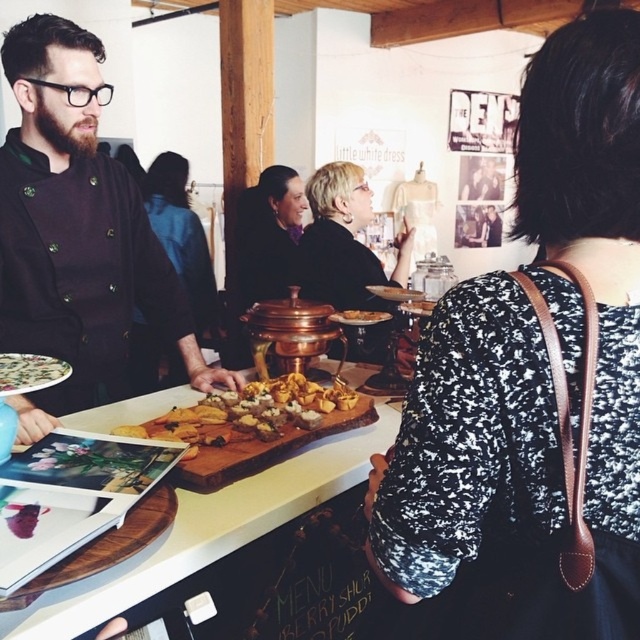
You are a guest at the event and want to place a golden brown cracker at center onto the wooden cutting board at center. Can you do this without moving any other items on the table?

The distance between the wooden cutting board at center and the golden brown cracker at center is 6.20 inches. Since you can easily reach across this distance, you can place the cracker onto the board without moving other items.

You are a guest at the event and want to move from the wooden cutting board at center to the black velvet dress at center. Is there enough space between them for you to walk through comfortably?

The distance between the wooden cutting board at center and the black velvet dress at center is 5.53 feet, which is more than enough space for a person to walk through comfortably.